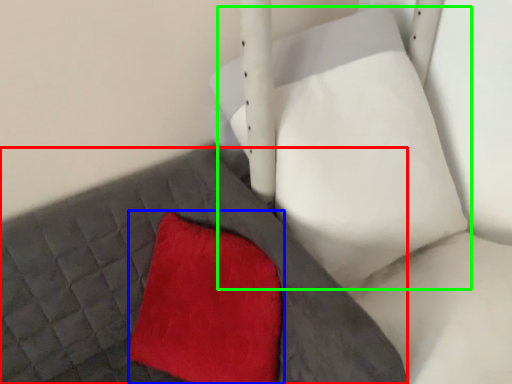
Question: Estimate the real-world distances between objects in this image. Which object is farther from bed frame (highlighted by a red box), throw pillow (highlighted by a blue box) or bean bag chair (highlighted by a green box)?

Choices:
 (A) throw pillow
 (B) bean bag chair

Answer: (B)